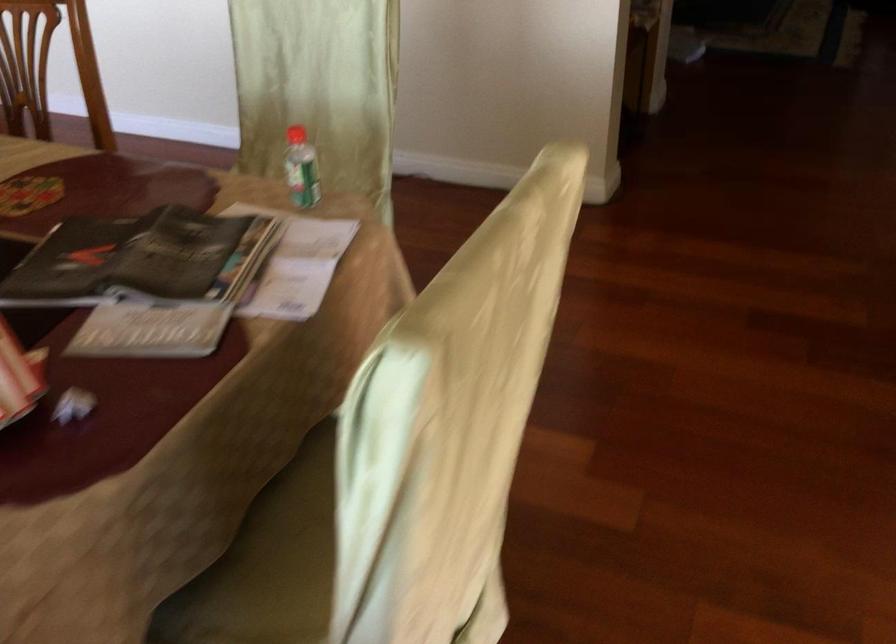
Image resolution: width=896 pixels, height=644 pixels. Find the location of `red bottle cap`. red bottle cap is located at coordinates (296, 135).